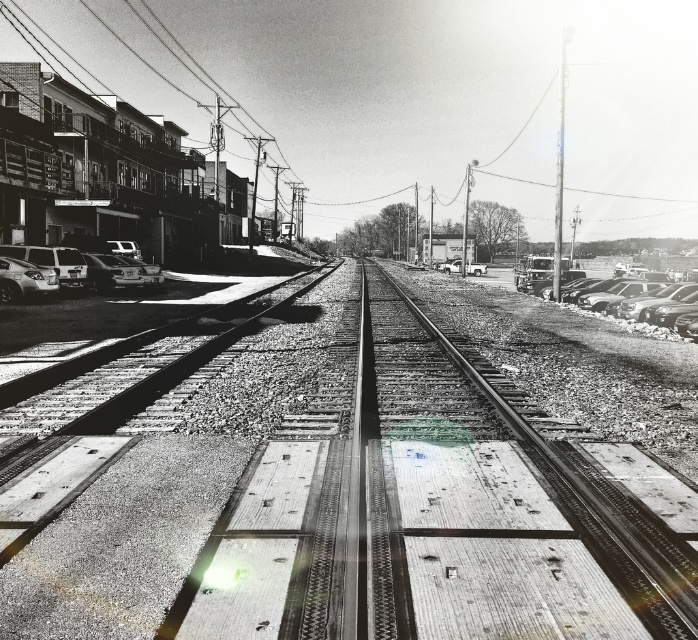
Question: Which is farther from the shiny black sedan at right?

Choices:
 (A) shiny silver sedan at lower left
 (B) smooth concrete train track at center
 (C) metallic silver car at center

Answer: (C)

Question: Where is metal/gravel railroad tracks at center located in relation to smooth concrete train track at center in the image?

Choices:
 (A) right
 (B) left

Answer: (B)

Question: Which object is positioned farthest from the shiny silver sedan at left?

Choices:
 (A) metal/gravel railroad tracks at center
 (B) shiny silver sedan at lower left
 (C) metallic silver car at center

Answer: (C)

Question: Observing the image, what is the correct spatial positioning of metal/gravel railroad tracks at center in reference to shiny silver sedan at left?

Choices:
 (A) left
 (B) right

Answer: (B)

Question: Is shiny black sedan at right to the left of shiny silver sedan at left from the viewer's perspective?

Choices:
 (A) no
 (B) yes

Answer: (A)

Question: Among these objects, which one is farthest from the camera?

Choices:
 (A) metal/gravel railroad tracks at center
 (B) smooth concrete train track at center
 (C) metallic silver car at center

Answer: (C)